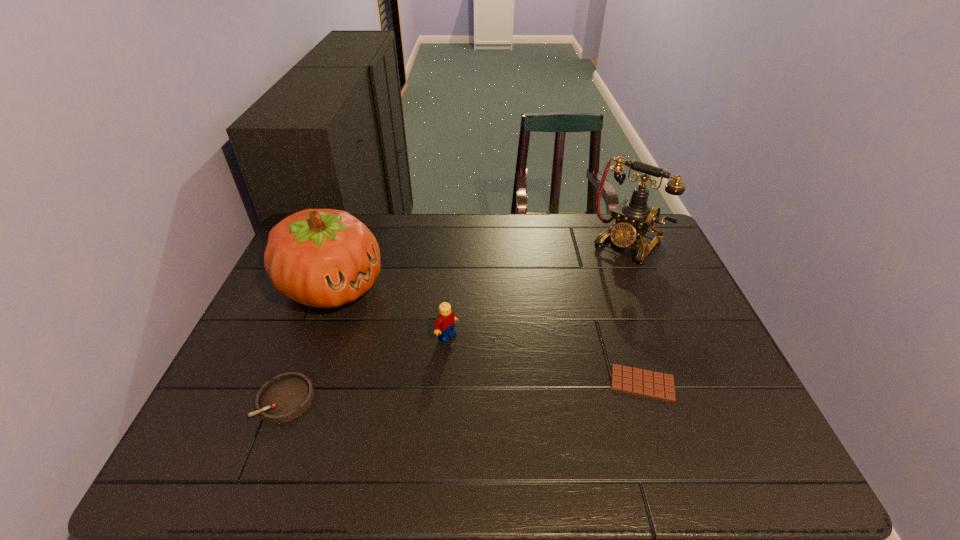
Identify the location of candy bar at the near edge. The width and height of the screenshot is (960, 540). (657, 385).

The image size is (960, 540). I want to click on ashtray at the left edge, so click(287, 396).

At what (x,y) coordinates should I click in order to perform the action: click on pumpkin located in the left edge section of the desktop. Please return your answer as a coordinate pair (x, y). Looking at the image, I should click on (325, 258).

You are a GUI agent. You are given a task and a screenshot of the screen. Output one action in this format:
    pyautogui.click(x=<x>, y=<y>)
    Task: Click on the candy bar that is at the right edge
    The image size is (960, 540).
    Given the screenshot: What is the action you would take?
    pyautogui.click(x=657, y=385)

This screenshot has width=960, height=540. I want to click on telephone that is positioned at the right edge, so point(634,218).

Find the location of a particular element. This screenshot has height=540, width=960. object that is at the far left corner is located at coordinates (325, 258).

The height and width of the screenshot is (540, 960). Find the location of `object present at the near left corner`. object present at the near left corner is located at coordinates (287, 396).

At what (x,y) coordinates should I click in order to perform the action: click on object located at the far right corner. Please return your answer as a coordinate pair (x, y). Looking at the image, I should click on (634, 218).

Find the location of `object that is at the near right corner`. object that is at the near right corner is located at coordinates (657, 385).

In the image, there is a desktop. Where is `free space at the far edge`? This screenshot has height=540, width=960. free space at the far edge is located at coordinates (442, 248).